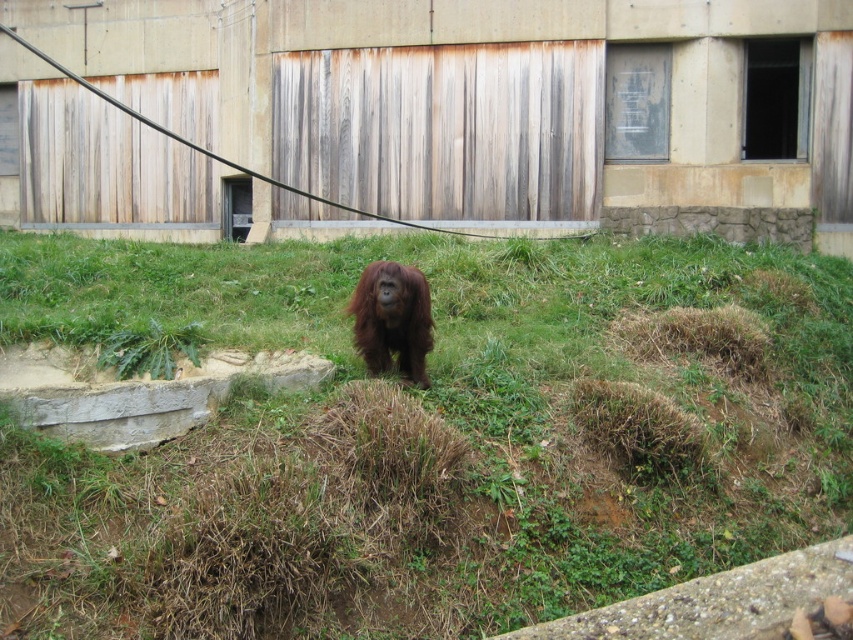
Question: Does green grassy at center have a smaller size compared to brown furry orangutan at center?

Choices:
 (A) no
 (B) yes

Answer: (A)

Question: Which object is farther from the camera taking this photo?

Choices:
 (A) brown furry orangutan at center
 (B) green grassy at center

Answer: (A)

Question: Which point is closer to the camera?

Choices:
 (A) (424, 365)
 (B) (788, 307)

Answer: (A)

Question: Observing the image, what is the correct spatial positioning of green grassy at center in reference to brown furry orangutan at center?

Choices:
 (A) above
 (B) below

Answer: (A)

Question: Can you confirm if green grassy at center is bigger than brown furry orangutan at center?

Choices:
 (A) yes
 (B) no

Answer: (A)